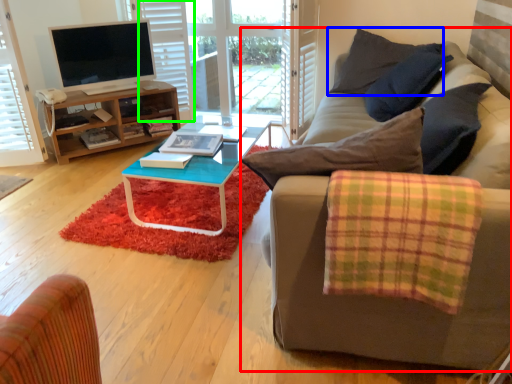
Question: Based on their relative distances, which object is farther from studio couch (highlighted by a red box)? Choose from pillow (highlighted by a blue box) and shutter (highlighted by a green box).

Choices:
 (A) pillow
 (B) shutter

Answer: (B)